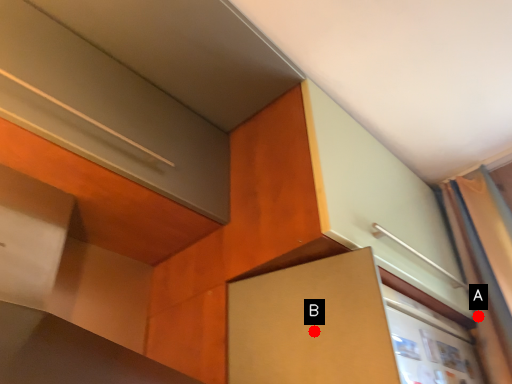
Question: Two points are circled on the image, labeled by A and B beside each circle. Which point is closer to the camera?

Choices:
 (A) A is closer
 (B) B is closer

Answer: (B)